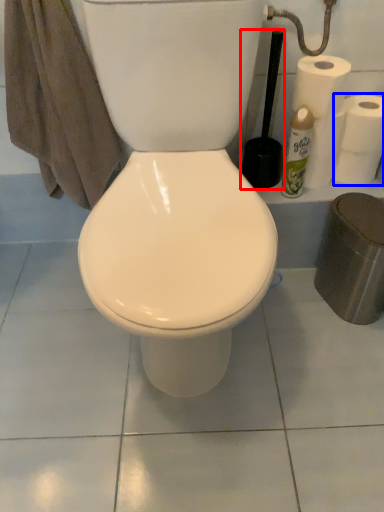
Question: Which object is closer to the camera taking this photo, brush (highlighted by a red box) or toilet paper (highlighted by a blue box)?

Choices:
 (A) brush
 (B) toilet paper

Answer: (A)